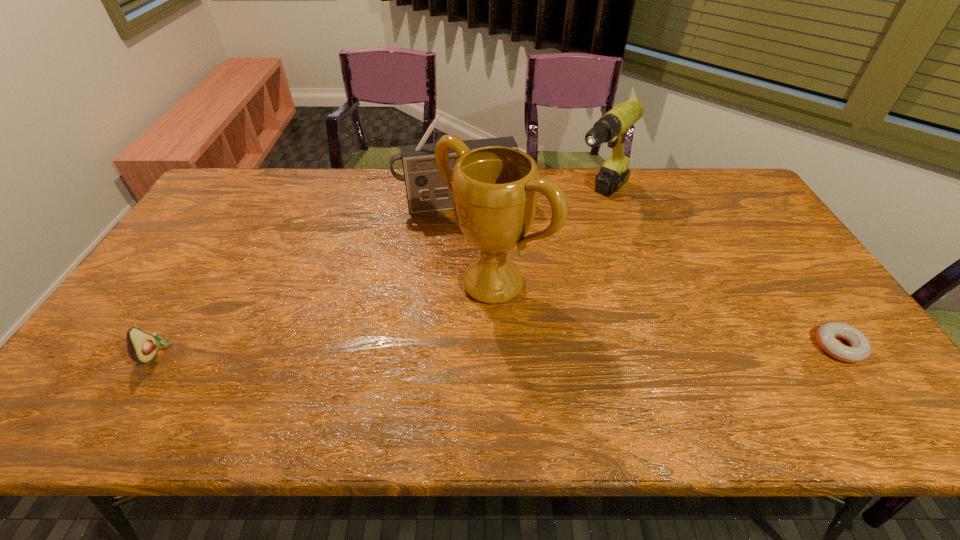
You are a GUI agent. You are given a task and a screenshot of the screen. Output one action in this format:
    pyautogui.click(x=<x>, y=<y>)
    Task: Click on the vacant area at the far right corner
    Image resolution: width=960 pixels, height=540 pixels.
    Given the screenshot: What is the action you would take?
    pyautogui.click(x=726, y=171)

Identify the location of unoccupied position between the avocado and the rightmost object. (x=497, y=349).

You are a GUI agent. You are given a task and a screenshot of the screen. Output one action in this format:
    pyautogui.click(x=<x>, y=<y>)
    Task: Click on the empty space between the second shortest object and the radio receiver
    The width and height of the screenshot is (960, 540).
    Given the screenshot: What is the action you would take?
    pyautogui.click(x=306, y=278)

Identify the location of free space between the tallest object and the doughnut. The image size is (960, 540). (666, 315).

Where is `free point between the tallest object and the shortest object`? The image size is (960, 540). free point between the tallest object and the shortest object is located at coordinates (666, 315).

Locate an element on the screen. vacant point located between the leftmost object and the drill is located at coordinates (378, 274).

Where is `empty space between the fourth tallest object and the shortest object`? The width and height of the screenshot is (960, 540). empty space between the fourth tallest object and the shortest object is located at coordinates (497, 349).

This screenshot has height=540, width=960. Identify the location of free spot between the fourth object from left to right and the third farthest object. (546, 240).

Locate an element on the screen. The height and width of the screenshot is (540, 960). vacant area that lies between the avocado and the fourth object from left to right is located at coordinates (378, 274).

Where is `the third closest object relative to the tallest object`? This screenshot has height=540, width=960. the third closest object relative to the tallest object is located at coordinates (860, 350).